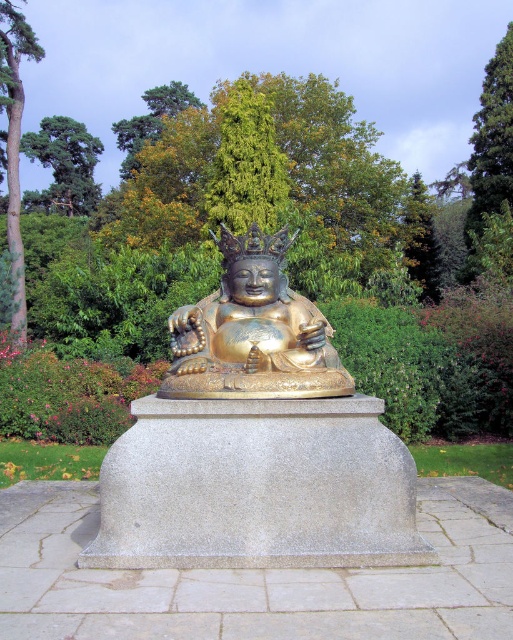
You are a visitor at this peaceful garden and want to take a photo of the gold polished statue at center without any obstruction. Is there a tree branch from the green leafy tree at upper left blocking the statue?

The gold polished statue at center is positioned under the green leafy tree at upper left, so there might be branches from the green leafy tree at upper left obstructing the statue. Check for any branches before taking the photo.

You are standing in front of the golden Buddha statue and notice two green leafy trees in the background. Which tree is positioned lower in the image, the green leafy tree at upper right or the green leafy tree at upper left?

The green leafy tree at upper right is located below the green leafy tree at upper left, so it is positioned lower in the image.